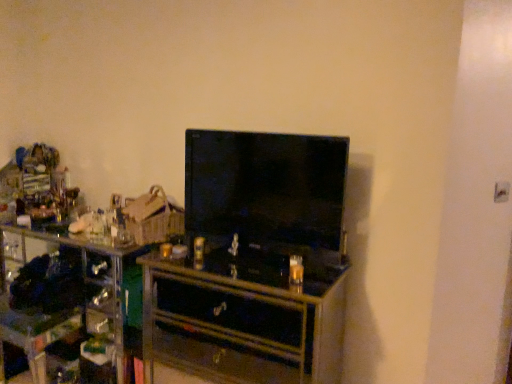
Question: From a real-world perspective, is black glossy television at center physically located above or below wooden chest of drawers at center?

Choices:
 (A) above
 (B) below

Answer: (A)

Question: Is black glossy television at center bigger or smaller than wooden chest of drawers at center?

Choices:
 (A) small
 (B) big

Answer: (A)

Question: From the image's perspective, is black glossy television at center located above or below wooden chest of drawers at center?

Choices:
 (A) above
 (B) below

Answer: (A)

Question: Is wooden chest of drawers at center to the left or to the right of black glossy television at center in the image?

Choices:
 (A) right
 (B) left

Answer: (B)

Question: Is wooden chest of drawers at center inside the boundaries of black glossy television at center, or outside?

Choices:
 (A) inside
 (B) outside

Answer: (B)

Question: Looking at the image, does wooden chest of drawers at center seem bigger or smaller compared to black glossy television at center?

Choices:
 (A) big
 (B) small

Answer: (A)

Question: From their relative heights in the image, would you say wooden chest of drawers at center is taller or shorter than black glossy television at center?

Choices:
 (A) short
 (B) tall

Answer: (B)